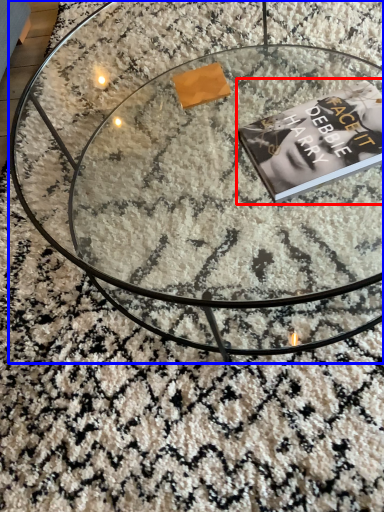
Question: Which of the following is the closest to the observer, paperback book (highlighted by a red box) or coffee table (highlighted by a blue box)?

Choices:
 (A) paperback book
 (B) coffee table

Answer: (B)